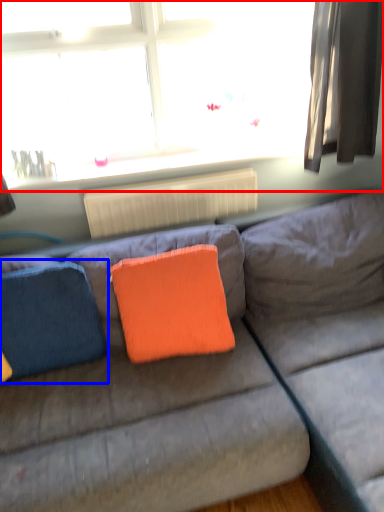
Question: Which of the following is the closest to the observer, window (highlighted by a red box) or pillow (highlighted by a blue box)?

Choices:
 (A) window
 (B) pillow

Answer: (B)